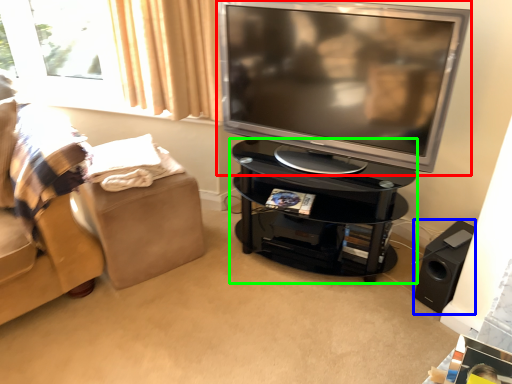
Question: Which object is the farthest from television (highlighted by a red box)? Choose among these: speaker (highlighted by a blue box) or table (highlighted by a green box).

Choices:
 (A) speaker
 (B) table

Answer: (A)